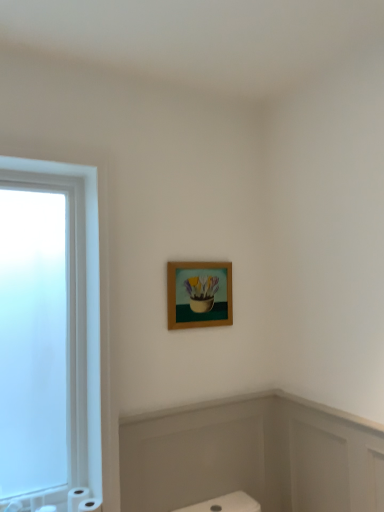
Question: From a real-world perspective, is white matte toilet paper at lower left, which is counted as the third toilet paper, starting from the left, physically above white matte toilet paper at lower left, the second toilet paper from the left?

Choices:
 (A) no
 (B) yes

Answer: (B)

Question: Is white matte toilet paper at lower left, which is counted as the third toilet paper, starting from the left, closer to the viewer compared to white matte toilet paper at lower left, placed as the second toilet paper when sorted from right to left?

Choices:
 (A) yes
 (B) no

Answer: (A)

Question: Is white matte toilet paper at lower left, which is counted as the third toilet paper, starting from the left, far from white matte toilet paper at lower left, placed as the second toilet paper when sorted from right to left?

Choices:
 (A) no
 (B) yes

Answer: (A)

Question: Considering the relative sizes of white matte toilet paper at lower left, which is counted as the third toilet paper, starting from the left, and white matte toilet paper at lower left, the second toilet paper from the left, in the image provided, is white matte toilet paper at lower left, which is counted as the third toilet paper, starting from the left, smaller than white matte toilet paper at lower left, the second toilet paper from the left,?

Choices:
 (A) no
 (B) yes

Answer: (B)

Question: Does white matte toilet paper at lower left, which is counted as the third toilet paper, starting from the left, turn towards white matte toilet paper at lower left, placed as the second toilet paper when sorted from right to left?

Choices:
 (A) yes
 (B) no

Answer: (B)

Question: Looking at their shapes, would you say white matte toilet paper at lower left, positioned as the first toilet paper in right-to-left order, is wider or thinner than white matte toilet paper at lower left, the second toilet paper from the left?

Choices:
 (A) thin
 (B) wide

Answer: (A)

Question: Considering the positions of point (96, 510) and point (81, 490), is point (96, 510) closer or farther from the camera than point (81, 490)?

Choices:
 (A) farther
 (B) closer

Answer: (B)

Question: In the image, is white matte toilet paper at lower left, which is counted as the third toilet paper, starting from the left, on the left side or the right side of white matte toilet paper at lower left, the second toilet paper from the left?

Choices:
 (A) left
 (B) right

Answer: (B)

Question: Is white matte toilet paper at lower left, which is counted as the third toilet paper, starting from the left, inside or outside of white matte toilet paper at lower left, the second toilet paper from the left?

Choices:
 (A) inside
 (B) outside

Answer: (B)

Question: In terms of height, does white matte toilet paper at lower left, placed as the second toilet paper when sorted from right to left, look taller or shorter compared to white matte toilet paper at lower left, which ranks as the 1th toilet paper in left-to-right order?

Choices:
 (A) short
 (B) tall

Answer: (B)

Question: From the image's perspective, relative to white matte toilet paper at lower left, which ranks as the 1th toilet paper in left-to-right order, is white matte toilet paper at lower left, the second toilet paper from the left, above or below?

Choices:
 (A) below
 (B) above

Answer: (B)

Question: Looking at their shapes, would you say white matte toilet paper at lower left, the second toilet paper from the left, is wider or thinner than white matte toilet paper at lower left, which ranks as the 1th toilet paper in left-to-right order?

Choices:
 (A) wide
 (B) thin

Answer: (B)

Question: Is point (82, 487) closer or farther from the camera than point (46, 504)?

Choices:
 (A) farther
 (B) closer

Answer: (A)

Question: From a real-world perspective, is wooden frame at upper center positioned above or below white matte toilet paper at lower left, which is counted as the third toilet paper, starting from the left?

Choices:
 (A) above
 (B) below

Answer: (A)

Question: In terms of height, does wooden frame at upper center look taller or shorter compared to white matte toilet paper at lower left, positioned as the first toilet paper in right-to-left order?

Choices:
 (A) tall
 (B) short

Answer: (A)